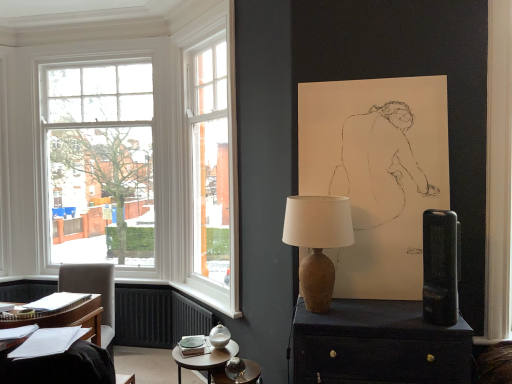
Question: Is black plastic speaker at right oriented away from light gray fabric chair at left?

Choices:
 (A) no
 (B) yes

Answer: (A)

Question: From a real-world perspective, is black plastic speaker at right over light gray fabric chair at left?

Choices:
 (A) yes
 (B) no

Answer: (A)

Question: Is black plastic speaker at right not close to light gray fabric chair at left?

Choices:
 (A) yes
 (B) no

Answer: (A)

Question: Is black plastic speaker at right next to light gray fabric chair at left and touching it?

Choices:
 (A) no
 (B) yes

Answer: (A)

Question: Can we say black plastic speaker at right lies outside light gray fabric chair at left?

Choices:
 (A) yes
 (B) no

Answer: (A)

Question: From the image's perspective, relative to white glass window at left, is matte brown side table at lower center above or below?

Choices:
 (A) below
 (B) above

Answer: (A)

Question: Relative to white glass window at left, is matte brown side table at lower center in front or behind?

Choices:
 (A) front
 (B) behind

Answer: (A)

Question: In terms of size, does matte brown side table at lower center appear bigger or smaller than white glass window at left?

Choices:
 (A) small
 (B) big

Answer: (A)

Question: In terms of width, does matte brown side table at lower center look wider or thinner when compared to white glass window at left?

Choices:
 (A) thin
 (B) wide

Answer: (B)

Question: Considering their positions, is light gray fabric chair at left located in front of or behind black plastic speaker at right?

Choices:
 (A) behind
 (B) front

Answer: (A)

Question: Which is correct: light gray fabric chair at left is inside black plastic speaker at right, or outside of it?

Choices:
 (A) inside
 (B) outside

Answer: (B)

Question: From their relative heights in the image, would you say light gray fabric chair at left is taller or shorter than black plastic speaker at right?

Choices:
 (A) short
 (B) tall

Answer: (B)

Question: Does point (64, 284) appear closer or farther from the camera than point (430, 276)?

Choices:
 (A) closer
 (B) farther

Answer: (B)

Question: In the image, is brown ceramic lamp at center positioned in front of or behind black plastic speaker at right?

Choices:
 (A) front
 (B) behind

Answer: (B)

Question: Visually, is brown ceramic lamp at center positioned to the left or to the right of black plastic speaker at right?

Choices:
 (A) left
 (B) right

Answer: (A)